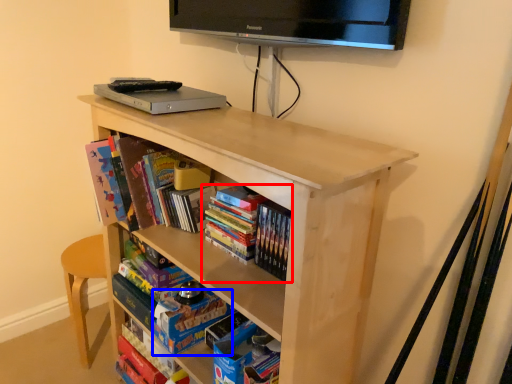
Question: Which object is closer to the camera taking this photo, book (highlighted by a red box) or paperback book (highlighted by a blue box)?

Choices:
 (A) book
 (B) paperback book

Answer: (A)